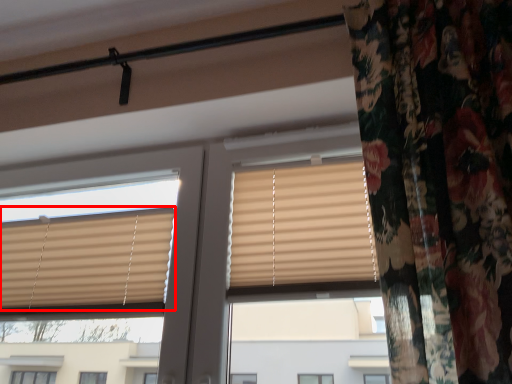
Question: From the image's perspective, what is the correct spatial positioning of window blind (annotated by the red box) in reference to window?

Choices:
 (A) above
 (B) below

Answer: (B)